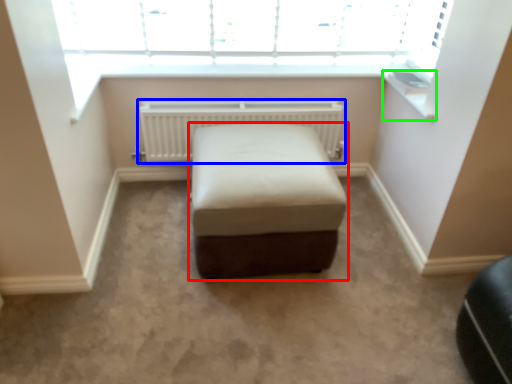
Question: Considering the real-world distances, which object is farthest from furniture (highlighted by a red box)? radiator (highlighted by a blue box) or window sill (highlighted by a green box)?

Choices:
 (A) radiator
 (B) window sill

Answer: (B)